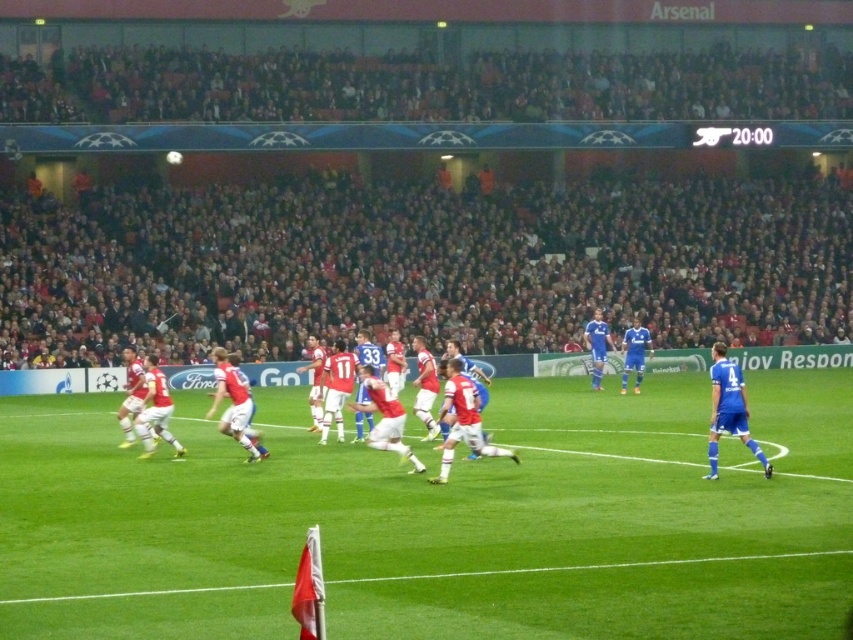
Does green grass football field at center have a greater height compared to blue smooth jersey at right?

No, green grass football field at center is not taller than blue smooth jersey at right.

Identify the location of green grass football field at center. The image size is (853, 640). (440, 522).

This screenshot has width=853, height=640. What are the coordinates of `green grass football field at center` in the screenshot? It's located at (440, 522).